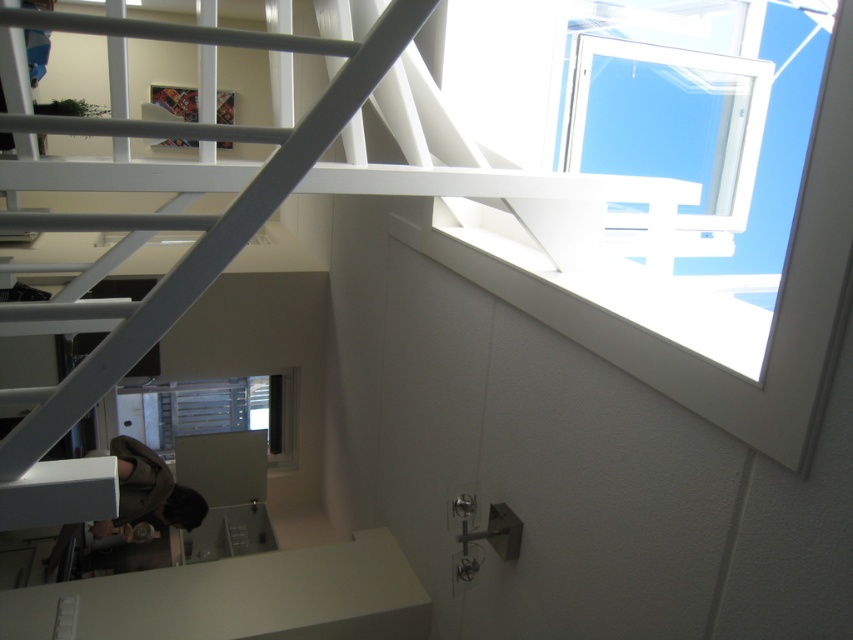
Is transparent glass window at upper right taller than clear glass window at center?

Yes, transparent glass window at upper right is taller than clear glass window at center.

Between transparent glass window at upper right and clear glass window at center, which one appears on the left side from the viewer's perspective?

clear glass window at center is more to the left.

Find the location of `transparent glass window at upper right`. transparent glass window at upper right is located at coordinates (666, 140).

The width and height of the screenshot is (853, 640). In order to click on transparent glass window at upper right in this screenshot , I will do `click(666, 140)`.

Can you confirm if white matte stair at upper right is shorter than clear glass window at center?

No.

Who is taller, white matte stair at upper right or clear glass window at center?

Standing taller between the two is white matte stair at upper right.

You are a GUI agent. You are given a task and a screenshot of the screen. Output one action in this format:
    pyautogui.click(x=<x>, y=<y>)
    Task: Click on the white matte stair at upper right
    
    Given the screenshot: What is the action you would take?
    pyautogui.click(x=424, y=116)

Image resolution: width=853 pixels, height=640 pixels. I want to click on white matte stair at upper right, so [424, 116].

Between transparent glass window at upper right and white matte ladder at upper left, which one is positioned lower?

white matte ladder at upper left is below.

Is point (602, 72) positioned behind point (387, 22)?

Yes, it is behind point (387, 22).

Locate an element on the screen. transparent glass window at upper right is located at coordinates (666, 140).